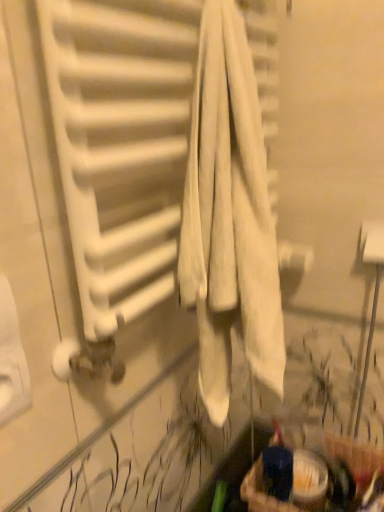
Image resolution: width=384 pixels, height=512 pixels. Describe the element at coordinates (285, 481) in the screenshot. I see `matte brown basket at lower right` at that location.

Image resolution: width=384 pixels, height=512 pixels. Find the location of `matte brown basket at lower right`. matte brown basket at lower right is located at coordinates (285, 481).

Find the location of a particular element. This screenshot has width=384, height=512. white matte radiator at center is located at coordinates (121, 143).

What do you see at coordinates (121, 143) in the screenshot? This screenshot has width=384, height=512. I see `white matte radiator at center` at bounding box center [121, 143].

Measure the distance between point (274, 31) and camera.

Point (274, 31) is 76.40 centimeters from camera.

Identify the location of matte brown basket at lower right. (285, 481).

Between matte brown basket at lower right and white matte radiator at center, which one appears on the left side from the viewer's perspective?

white matte radiator at center.

Based on the photo, considering their positions, is matte brown basket at lower right located in front of or behind white matte radiator at center?

Visually, matte brown basket at lower right is located behind white matte radiator at center.

Is point (303, 455) closer or farther from the camera than point (136, 307)?

Point (303, 455) is farther from the camera than point (136, 307).

From the image's perspective, between matte brown basket at lower right and white matte radiator at center, who is located below?

matte brown basket at lower right.

From a real-world perspective, is matte brown basket at lower right on white matte radiator at center?

Actually, matte brown basket at lower right is physically below white matte radiator at center in the real world.

Looking at their sizes, would you say matte brown basket at lower right is wider or thinner than white matte radiator at center?

In the image, matte brown basket at lower right appears to be more narrow than white matte radiator at center.

From their relative heights in the image, would you say matte brown basket at lower right is taller or shorter than white matte radiator at center?

Clearly, matte brown basket at lower right is shorter compared to white matte radiator at center.

Does matte brown basket at lower right have a smaller size compared to white matte radiator at center?

Correct, matte brown basket at lower right occupies less space than white matte radiator at center.

Is matte brown basket at lower right spatially inside white matte radiator at center, or outside of it?

matte brown basket at lower right is not inside white matte radiator at center, it's outside.

From the picture: Is matte brown basket at lower right far from white matte radiator at center?

That's not correct — matte brown basket at lower right is a little close to white matte radiator at center.

Is matte brown basket at lower right oriented away from white matte radiator at center?

No.

The height and width of the screenshot is (512, 384). In order to click on radiator above the matte brown basket at lower right (from a real-world perspective) in this screenshot , I will do `click(121, 143)`.

Can you confirm if white matte radiator at center is positioned to the right of matte brown basket at lower right?

In fact, white matte radiator at center is to the left of matte brown basket at lower right.

Is white matte radiator at center behind matte brown basket at lower right?

No, it is not.

Is point (88, 144) in front of point (326, 472)?

Yes, it is.

From the image's perspective, is white matte radiator at center located beneath matte brown basket at lower right?

No.

From a real-world perspective, is white matte radiator at center on top of matte brown basket at lower right?

Yes.

Consider the image. Between white matte radiator at center and matte brown basket at lower right, which one has larger width?

white matte radiator at center is wider.

Considering the sizes of objects white matte radiator at center and matte brown basket at lower right in the image provided, who is shorter, white matte radiator at center or matte brown basket at lower right?

matte brown basket at lower right is shorter.

Can you confirm if white matte radiator at center is smaller than matte brown basket at lower right?

No.

Which is correct: white matte radiator at center is inside matte brown basket at lower right, or outside of it?

white matte radiator at center is outside matte brown basket at lower right.

Is white matte radiator at center far away from matte brown basket at lower right?

They are positioned close to each other.

From the picture: Is white matte radiator at center facing away from matte brown basket at lower right?

white matte radiator at center does not have its back to matte brown basket at lower right.

This screenshot has width=384, height=512. In order to click on radiator in front of the matte brown basket at lower right in this screenshot , I will do `click(121, 143)`.

Locate an element on the screen. radiator that appears in front of the matte brown basket at lower right is located at coordinates pos(121,143).

There is a matte brown basket at lower right. Where is `radiator above it (from a real-world perspective)`? The width and height of the screenshot is (384, 512). radiator above it (from a real-world perspective) is located at coordinates (121, 143).